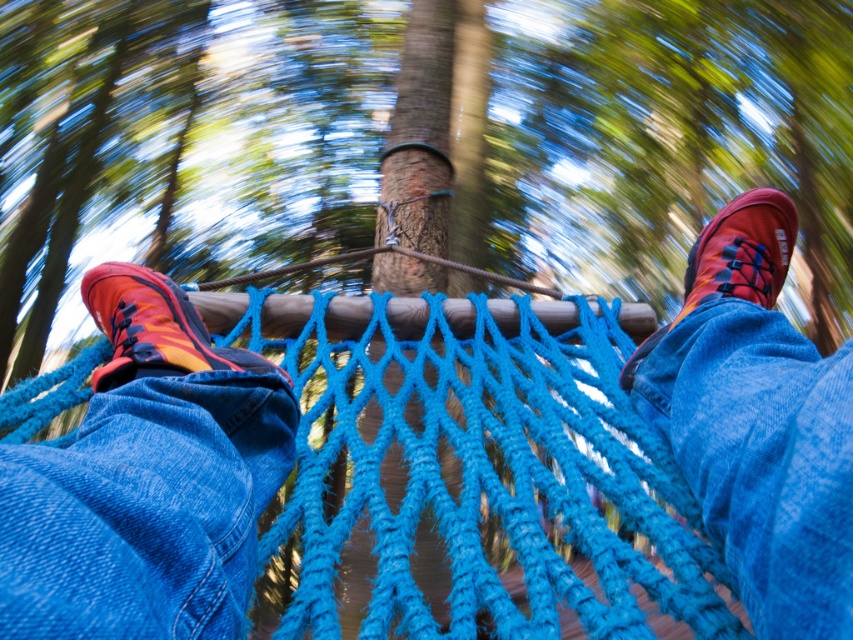
Is orange and black hiking boot at lower left bigger than matte orange shoe at upper left?

Actually, orange and black hiking boot at lower left might be smaller than matte orange shoe at upper left.

Is orange and black hiking boot at lower left to the right of matte orange shoe at upper left from the viewer's perspective?

In fact, orange and black hiking boot at lower left is to the left of matte orange shoe at upper left.

Is point (38, 490) positioned before point (671, 429)?

Yes.

Identify the location of orange and black hiking boot at lower left. This screenshot has height=640, width=853. (146, 480).

Is orange and black hiking boot at lower left bigger than matte orange shoe at upper right?

Incorrect, orange and black hiking boot at lower left is not larger than matte orange shoe at upper right.

Is orange and black hiking boot at lower left above matte orange shoe at upper right?

Actually, orange and black hiking boot at lower left is below matte orange shoe at upper right.

Where is `orange and black hiking boot at lower left`? orange and black hiking boot at lower left is located at coordinates (146, 480).

Does matte orange shoe at upper left appear under matte orange shoe at upper right?

Indeed, matte orange shoe at upper left is positioned under matte orange shoe at upper right.

Between matte orange shoe at upper left and matte orange shoe at upper right, which one appears on the right side from the viewer's perspective?

Positioned to the right is matte orange shoe at upper right.

Between point (798, 426) and point (746, 280), which one is positioned behind?

Point (746, 280)

Identify the location of matte orange shoe at upper left. This screenshot has height=640, width=853. (757, 422).